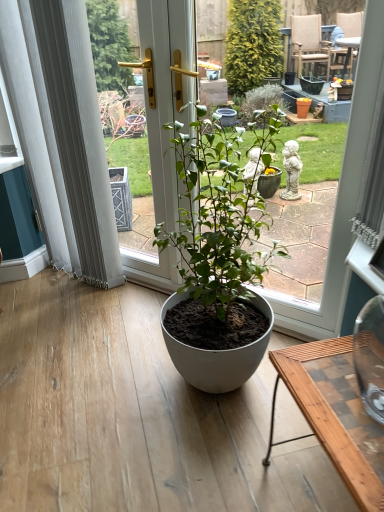
The height and width of the screenshot is (512, 384). Find the location of `unoccupied area in front of white sheer curtain at left`. unoccupied area in front of white sheer curtain at left is located at coordinates (108, 312).